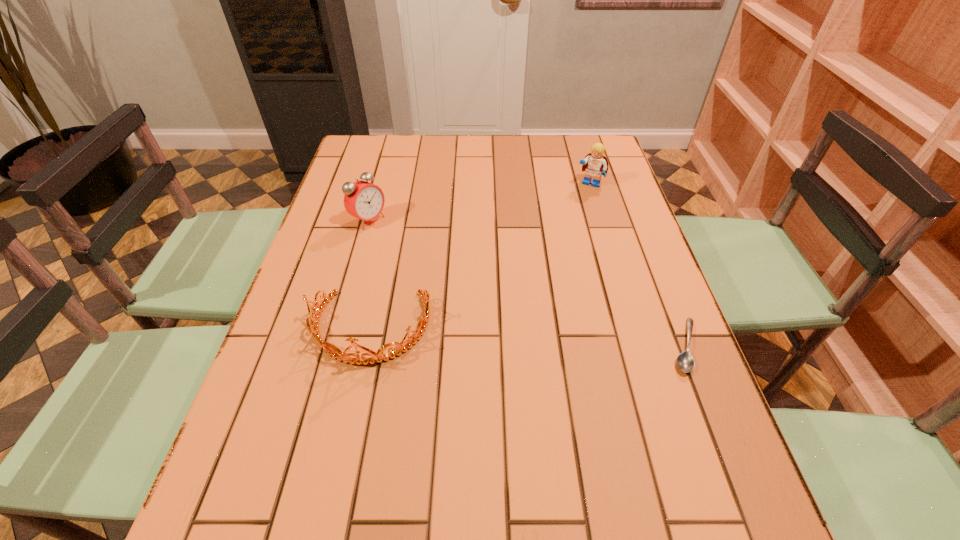
Identify the location of free space at the left edge of the desktop. pos(286,361).

Locate an element on the screen. free space at the right edge of the desktop is located at coordinates (578, 178).

In order to click on free region at the far left corner of the desktop in this screenshot , I will do `click(374, 157)`.

The width and height of the screenshot is (960, 540). In the image, there is a desktop. Find the location of `vacant space at the near left corner`. vacant space at the near left corner is located at coordinates (295, 473).

In the image, there is a desktop. Identify the location of vacant region at the far right corner. The width and height of the screenshot is (960, 540). (564, 134).

The height and width of the screenshot is (540, 960). Find the location of `vacant space that is in between the rightmost object and the alarm clock`. vacant space that is in between the rightmost object and the alarm clock is located at coordinates (527, 283).

This screenshot has height=540, width=960. I want to click on unoccupied position between the tiara and the rightmost object, so click(x=528, y=337).

Identify the location of free space between the tiara and the soupspoon. (528, 337).

At what (x,y) coordinates should I click in order to perform the action: click on free area in between the alarm clock and the third tallest object. Please return your answer as a coordinate pair (x, y). This screenshot has width=960, height=540. Looking at the image, I should click on (370, 274).

The height and width of the screenshot is (540, 960). I want to click on free space between the third nearest object and the Lego, so click(479, 202).